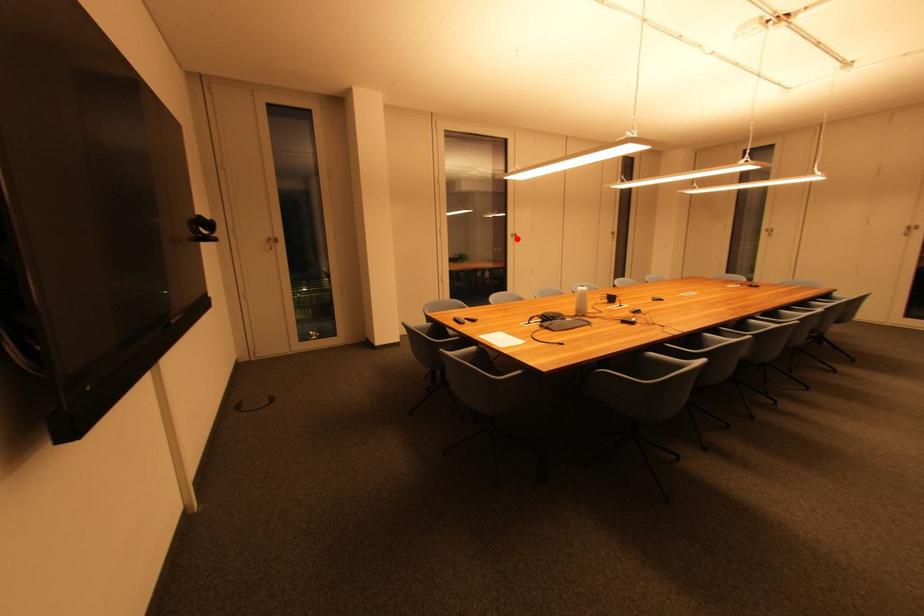
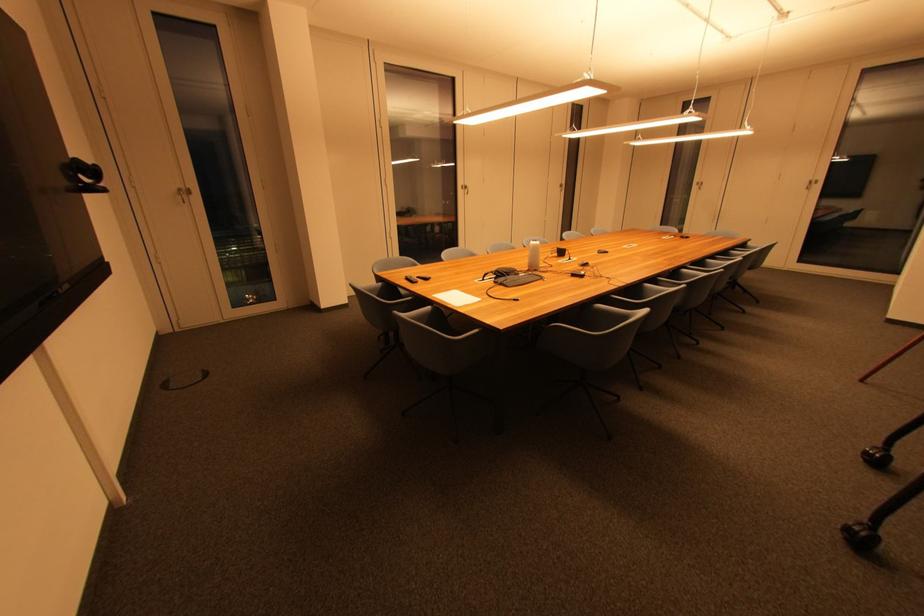
Question: A red point is marked in image1. In image2, is the corresponding 3D point closer to the camera or farther? Reply with the corresponding letter.

Choices:
 (A) The corresponding 3D point is closer.
 (B) The corresponding 3D point is farther.

Answer: (A)